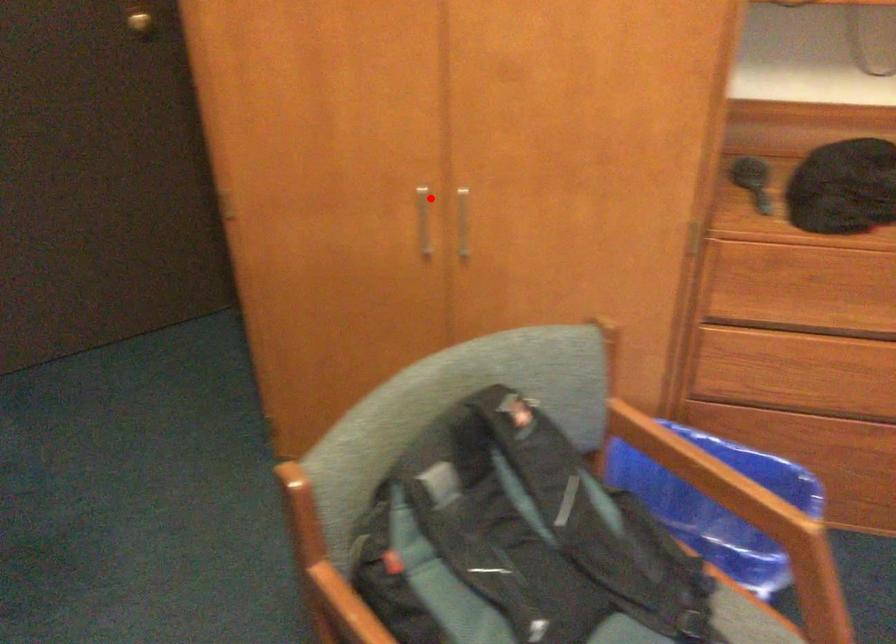
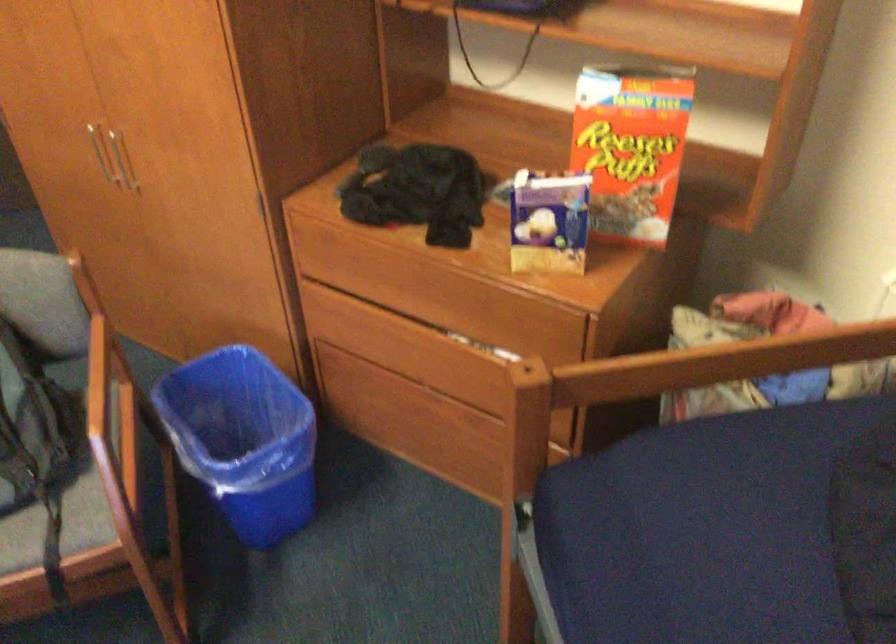
Where in the second image is the point corresponding to the highlighted location from the first image?

(97, 149)